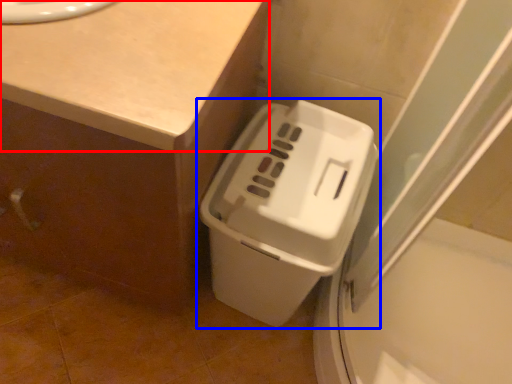
Question: Which point is closer to the camera, counter top (highlighted by a red box) or waste container (highlighted by a blue box)?

Choices:
 (A) counter top
 (B) waste container

Answer: (A)